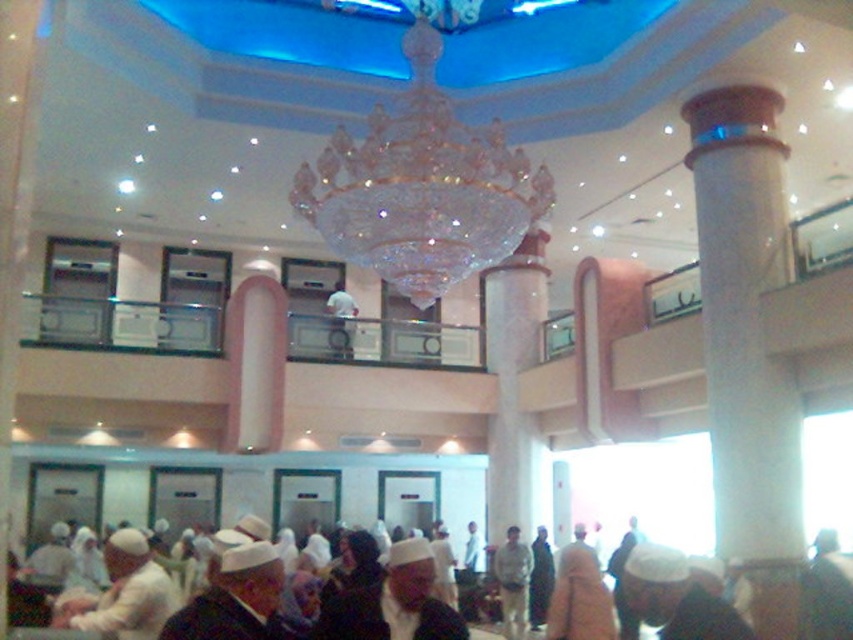
Question: Which object is positioned closest to the crystal glass chandelier at center?

Choices:
 (A) white fabric hat at center
 (B) light gray fabric shirt at center

Answer: (A)

Question: Can you confirm if white matte cap at center is wider than light gray fabric shirt at center?

Choices:
 (A) yes
 (B) no

Answer: (A)

Question: Which is nearer to the dark blue fabric robe at lower center?

Choices:
 (A) light gray fabric shirt at center
 (B) white fabric hat at center
 (C) white fabric shirt at upper center
 (D) black matte robe at lower center

Answer: (B)

Question: Can you confirm if white fabric hat at center is wider than white matte cap at center?

Choices:
 (A) no
 (B) yes

Answer: (A)

Question: Which object is farther from the camera taking this photo?

Choices:
 (A) light gray fabric shirt at center
 (B) white fabric hat at lower center

Answer: (A)

Question: Does white fabric hat at lower center have a larger size compared to white matte hat at center?

Choices:
 (A) no
 (B) yes

Answer: (A)